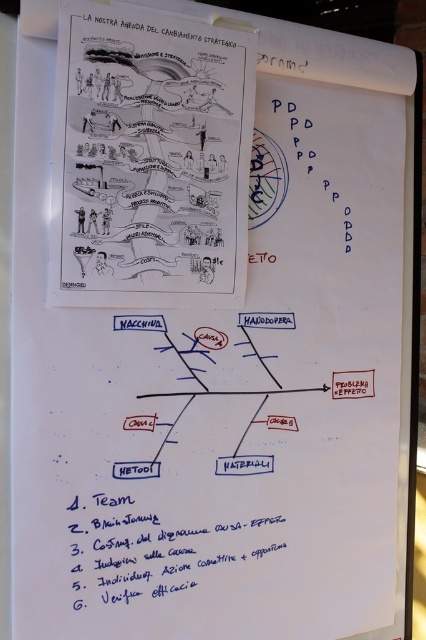
Question: Can you confirm if black paper at lower left is thinner than black paper at upper center?

Choices:
 (A) no
 (B) yes

Answer: (A)

Question: Which point is closer to the camera?

Choices:
 (A) black paper at lower left
 (B) black paper poster at upper center
 (C) black paper at upper center

Answer: (B)

Question: Can you confirm if black paper poster at upper center is positioned to the left of black paper at upper center?

Choices:
 (A) no
 (B) yes

Answer: (B)

Question: Can you confirm if black paper poster at upper center is positioned to the left of black paper at lower left?

Choices:
 (A) no
 (B) yes

Answer: (B)

Question: Which of the following is the closest to the observer?

Choices:
 (A) (256, 52)
 (B) (114, 12)
 (C) (77, 563)

Answer: (B)

Question: Which of these objects is positioned farthest from the black paper at lower left?

Choices:
 (A) black paper at upper center
 (B) black paper poster at upper center

Answer: (A)